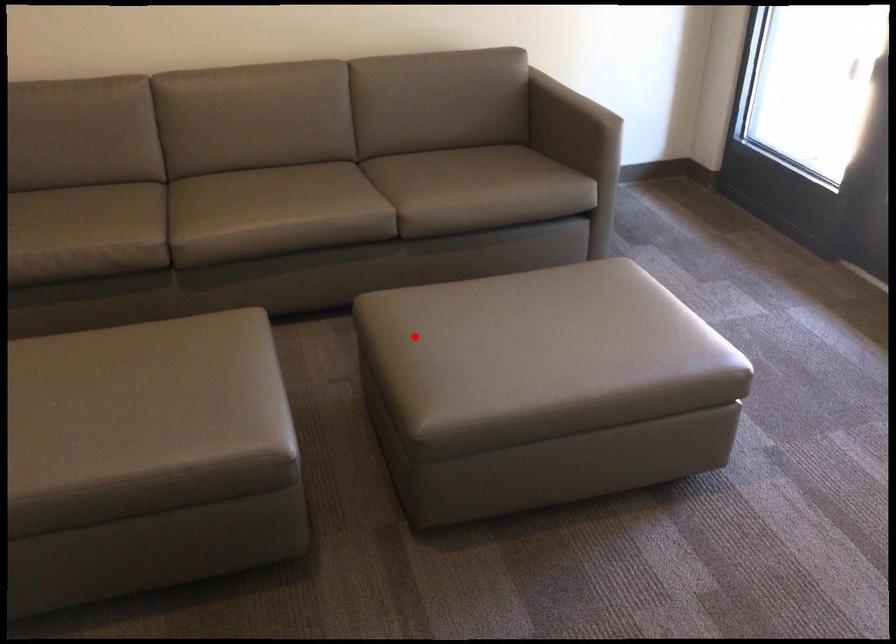
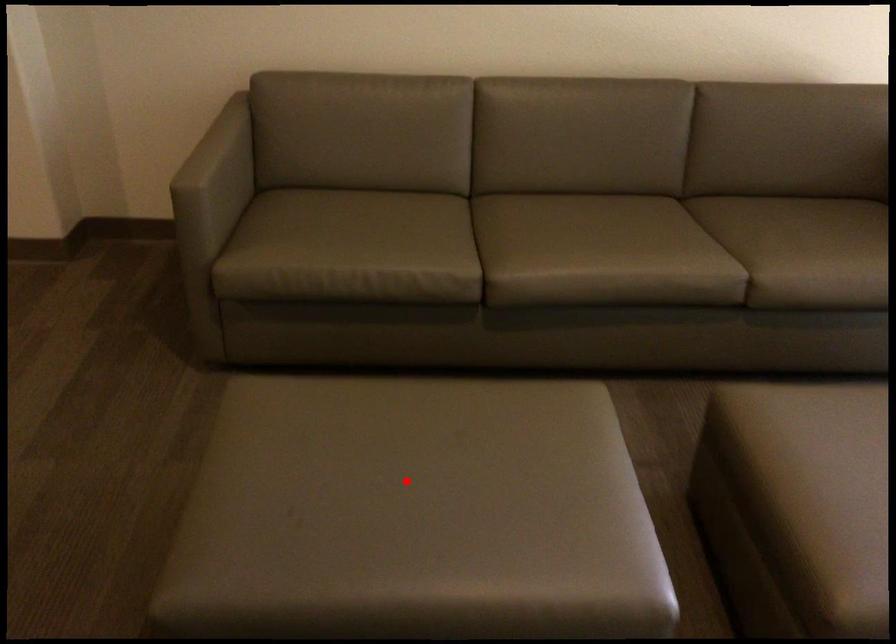
I am providing you with two images of the same scene from different viewpoints. A red point is marked on the first image and another point is marked on the second image. Does the point marked in image1 correspond to the same location as the one in image2?

No